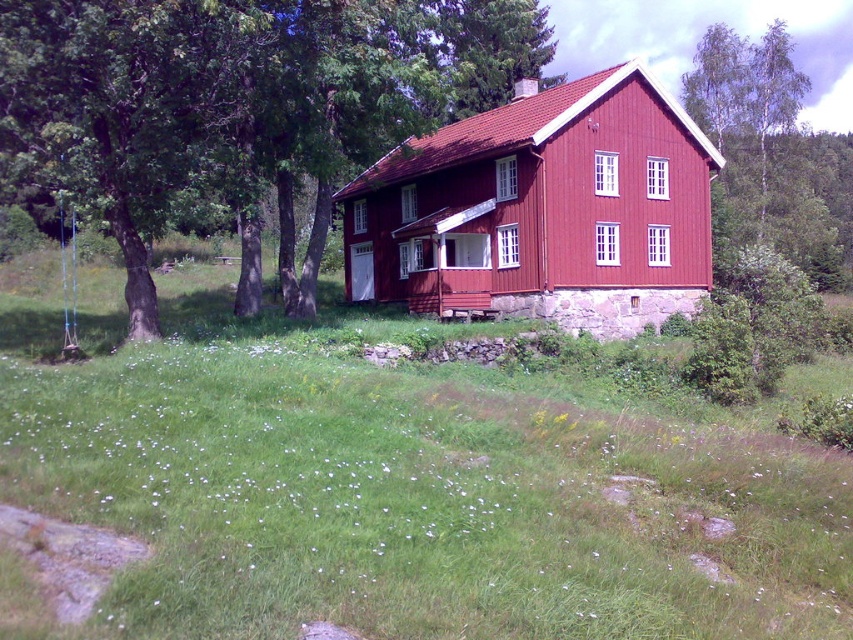
You are standing at the entrance of the rustic red wooden house. You notice a green leafy tree at center. Can you determine the direction of the tree relative to your position?

The green leafy tree at center is located at point coordinates, but without specific reference points, the exact direction cannot be determined. However, based on the description, it is positioned centrally in front of the house.

You are standing in the middle of a field and see the green leafy tree at center and the matte red wooden cabin at center. If you want to reach the cabin first, which direction should you walk relative to the tree?

You should walk away from the green leafy tree at center towards the matte red wooden cabin at center since they are 17.84 feet apart, so moving directly toward the cabin would be the shortest path.

You are standing in front of the green leafy tree at center and the matte red wooden cabin at center. Which object is closer to your right side?

The matte red wooden cabin at center is closer to your right side because the green leafy tree at center is positioned on the left side of it.